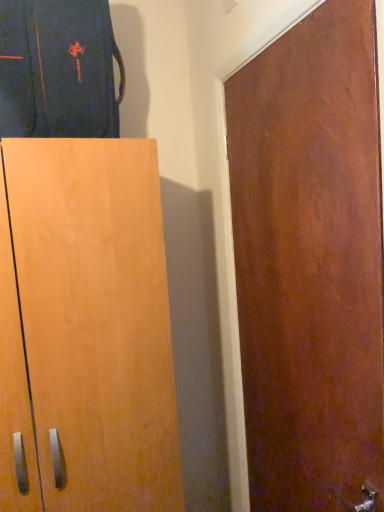
Where is `dark blue fabric jacket at upper left`? The height and width of the screenshot is (512, 384). dark blue fabric jacket at upper left is located at coordinates (58, 69).

What do you see at coordinates (58, 69) in the screenshot?
I see `dark blue fabric jacket at upper left` at bounding box center [58, 69].

This screenshot has height=512, width=384. In order to click on dark blue fabric jacket at upper left in this screenshot , I will do `click(58, 69)`.